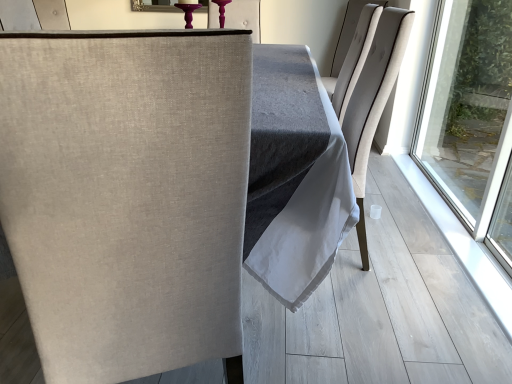
Question: In terms of height, does beige fabric chair at left, acting as the second chair starting from the back, look taller or shorter compared to light beige fabric chair at upper right, the second chair in the bottom-to-top sequence?

Choices:
 (A) tall
 (B) short

Answer: (A)

Question: Looking at the image, does beige fabric chair at left, the second chair viewed from the top, seem bigger or smaller compared to light beige fabric chair at upper right, the first chair positioned from the back?

Choices:
 (A) big
 (B) small

Answer: (A)

Question: From a real-world perspective, is beige fabric chair at left, acting as the second chair starting from the back, above or below light beige fabric chair at upper right, which ranks as the second chair in left-to-right order?

Choices:
 (A) above
 (B) below

Answer: (B)

Question: Considering the positions of point (356, 8) and point (91, 269), is point (356, 8) closer or farther from the camera than point (91, 269)?

Choices:
 (A) closer
 (B) farther

Answer: (B)

Question: Considering the positions of light beige fabric chair at upper right, acting as the first chair starting from the right, and beige fabric chair at left, positioned as the first chair in left-to-right order, in the image, is light beige fabric chair at upper right, acting as the first chair starting from the right, bigger or smaller than beige fabric chair at left, positioned as the first chair in left-to-right order,?

Choices:
 (A) small
 (B) big

Answer: (A)

Question: Looking at their shapes, would you say light beige fabric chair at upper right, which appears as the first chair when viewed from the top, is wider or thinner than beige fabric chair at left, acting as the second chair starting from the back?

Choices:
 (A) wide
 (B) thin

Answer: (B)

Question: Relative to beige fabric chair at left, positioned as the first chair in left-to-right order, is light beige fabric chair at upper right, the second chair in the bottom-to-top sequence, in front or behind?

Choices:
 (A) front
 (B) behind

Answer: (B)